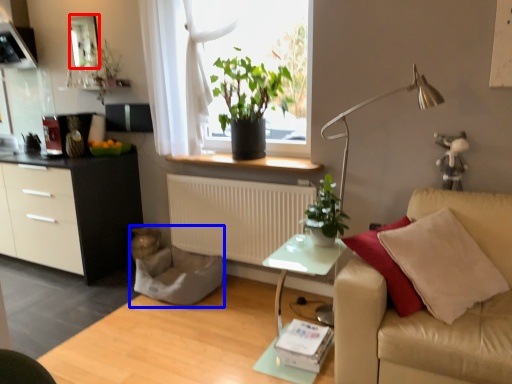
Question: Which of the following is the farthest to the observer, mirror (highlighted by a red box) or swivel chair (highlighted by a blue box)?

Choices:
 (A) mirror
 (B) swivel chair

Answer: (A)